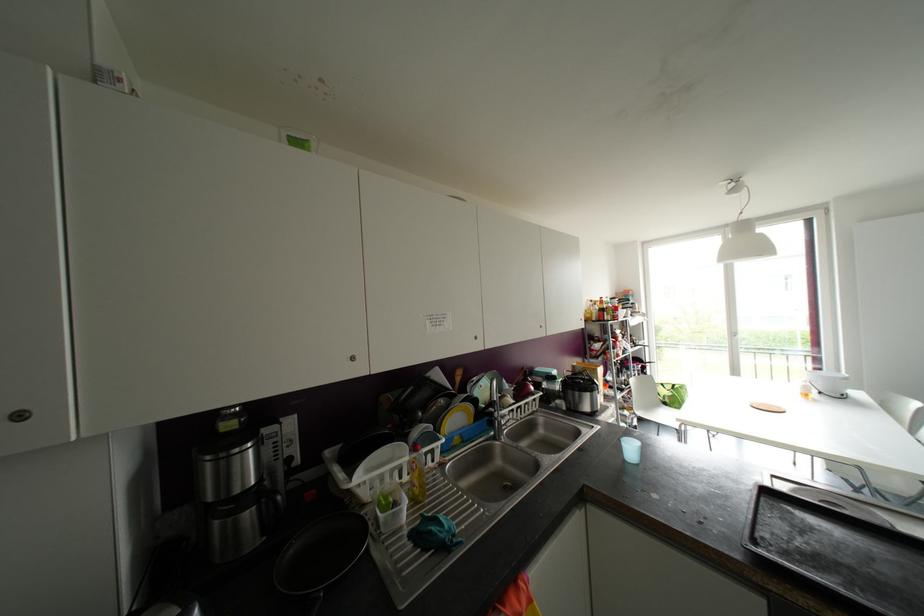
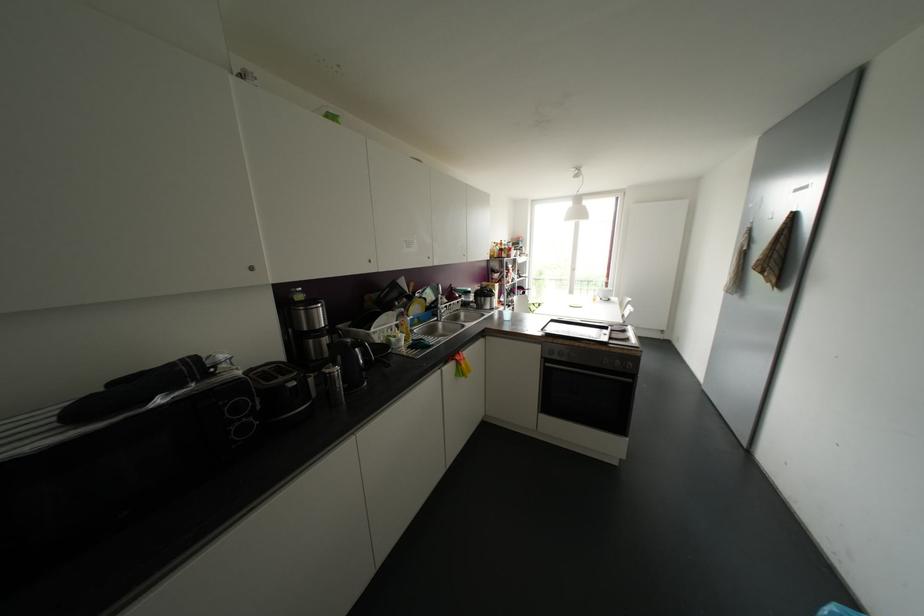
Question: The camera is either moving clockwise (left) or counter-clockwise (right) around the object. The first image is from the beginning of the video and the second image is from the end. Is the camera moving left or right when shooting the video?

Choices:
 (A) Left
 (B) Right

Answer: (A)